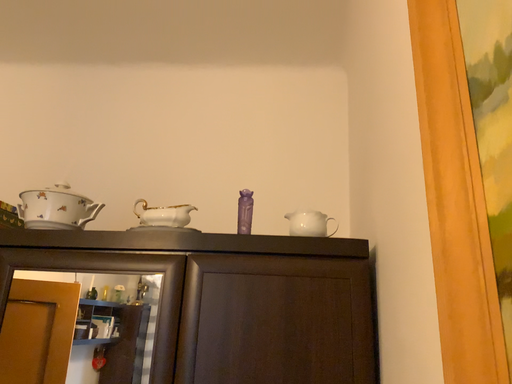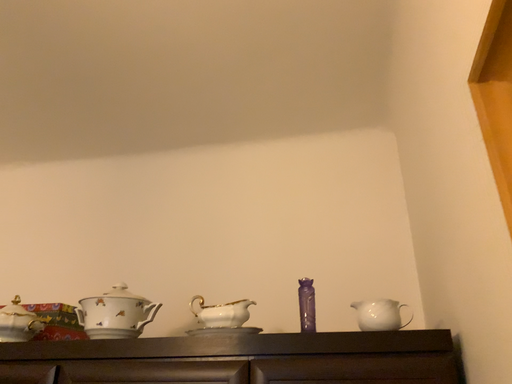
Question: How did the camera likely rotate when shooting the video?

Choices:
 (A) rotated downward
 (B) rotated upward

Answer: (B)